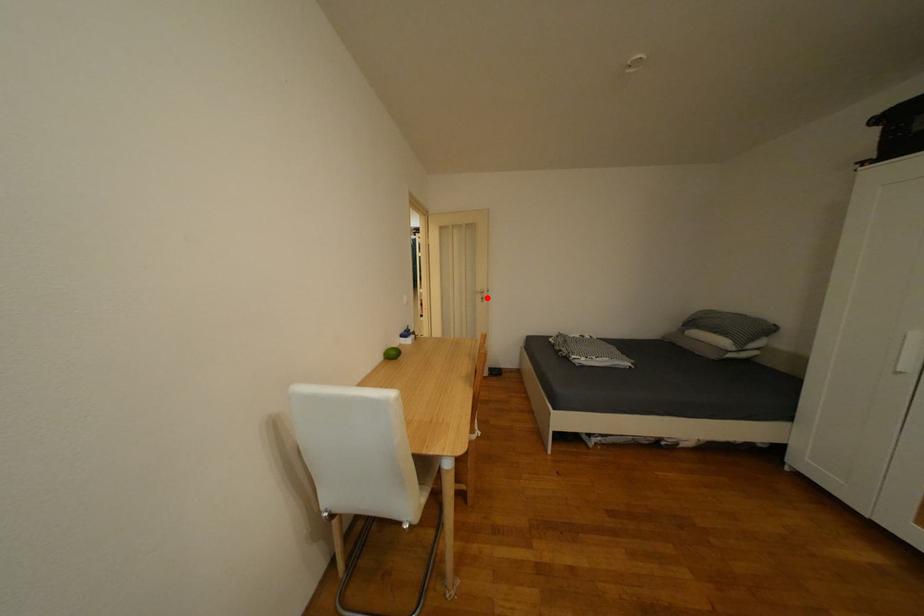
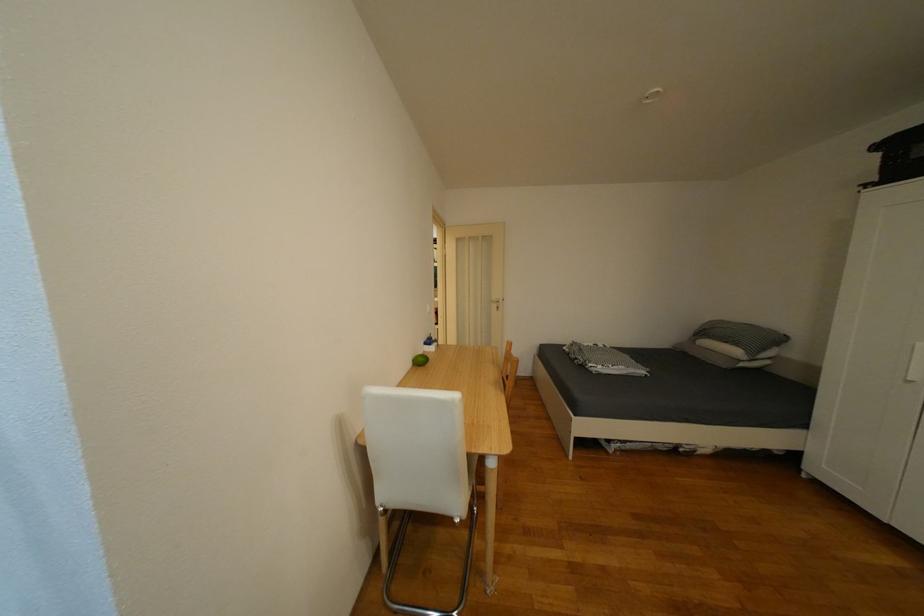
Locate, in the second image, the point that corresponds to the highlighted location in the first image.

(503, 307)